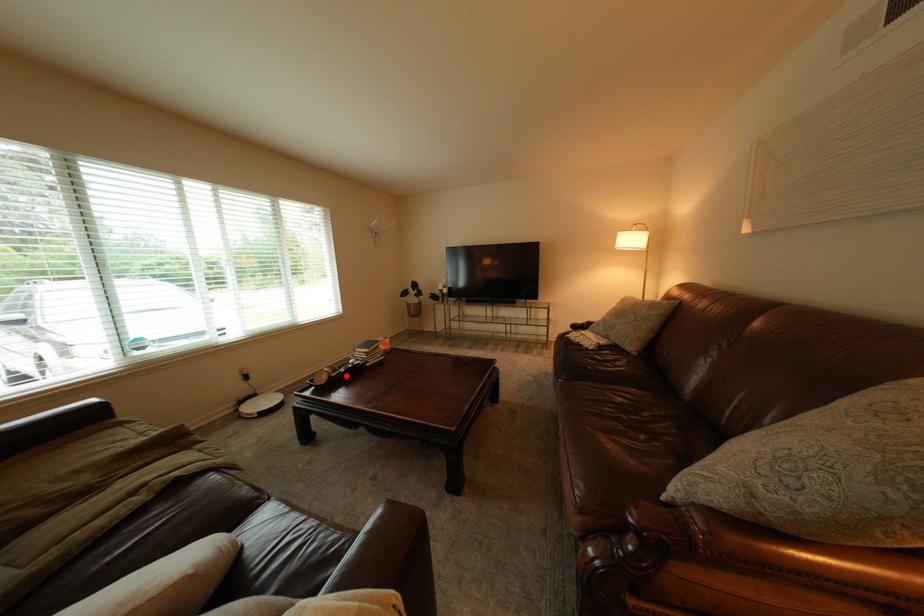
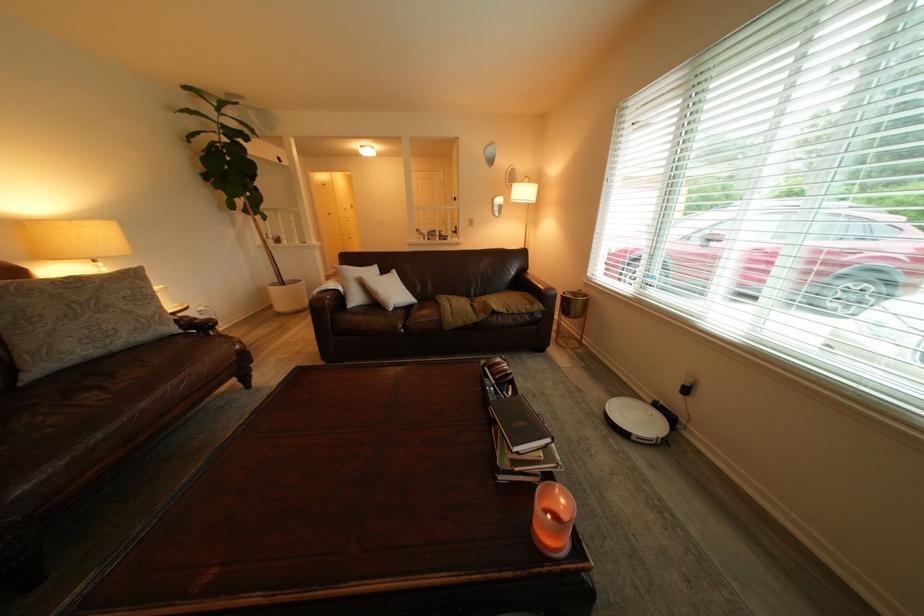
Question: A red point is marked in image1. In image2, is the corresponding 3D point closer to the camera or farther? Reply with the corresponding letter.

Choices:
 (A) The corresponding 3D point is closer.
 (B) The corresponding 3D point is farther.

Answer: (B)